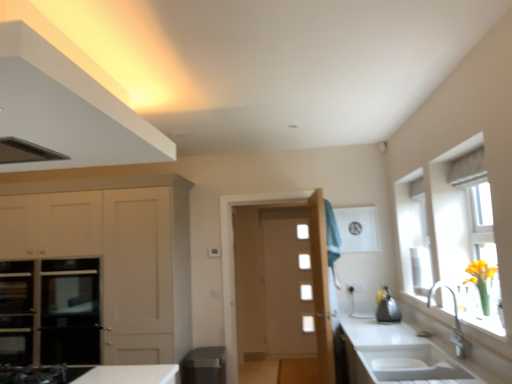
Question: Is white ceramic sink at lower right inside or outside of white matte cabinet at left, the 2th cabinetry positioned from the top?

Choices:
 (A) outside
 (B) inside

Answer: (A)

Question: Based on their positions, is white ceramic sink at lower right located to the left or right of white matte cabinet at left, the 1th cabinetry positioned from the bottom?

Choices:
 (A) left
 (B) right

Answer: (B)

Question: Estimate the real-world distances between objects in this image. Which object is closer to the matte white exhaust hood at upper left?

Choices:
 (A) black glass oven at lower left
 (B) matte white cabinet at upper left, placed as the second cabinetry when sorted from back to front
 (C) white matte cabinet at left, arranged as the first cabinetry when viewed from the back
 (D) satin black kettle at right
 (E) white ceramic sink at lower right

Answer: (B)

Question: Estimate the real-world distances between objects in this image. Which object is farther from the satin black kettle at right?

Choices:
 (A) matte white cabinet at upper left, placed as the 2th cabinetry when sorted from bottom to top
 (B) translucent glass window at right
 (C) white matte cabinet at left, positioned as the 2th cabinetry in front-to-back order
 (D) white ceramic sink at lower right
 (E) black glass oven at lower left

Answer: (E)